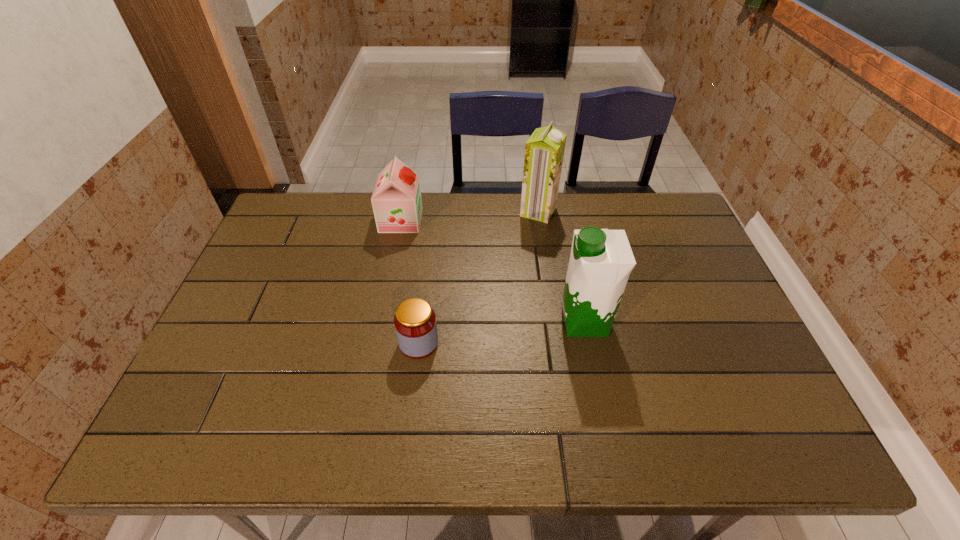
Point out which object is positioned as the nearest to the third tallest object. Please provide its 2D coordinates. Your answer should be formatted as a tuple, i.e. [(x, y)], where the tuple contains the x and y coordinates of a point satisfying the conditions above.

[(544, 151)]

Find the location of a particular element. The image size is (960, 540). object that stands as the closest to the shortest soya milk is located at coordinates (544, 151).

The width and height of the screenshot is (960, 540). What are the coordinates of `soya milk that stands as the second closest to the nearest soya milk` in the screenshot? It's located at (396, 200).

You are a GUI agent. You are given a task and a screenshot of the screen. Output one action in this format:
    pyautogui.click(x=<x>, y=<y>)
    Task: Click on the closest soya milk relative to the nearest soya milk
    
    Given the screenshot: What is the action you would take?
    pyautogui.click(x=544, y=151)

Identify the location of vacant space that satisfies the following two spatial constraints: 1. with the cap open on the third tallest object; 2. on the right side of the jar. (376, 343).

Where is `free space that satisfies the following two spatial constraints: 1. with the cap open on the jar; 2. on the right side of the third tallest object`? free space that satisfies the following two spatial constraints: 1. with the cap open on the jar; 2. on the right side of the third tallest object is located at coordinates (376, 343).